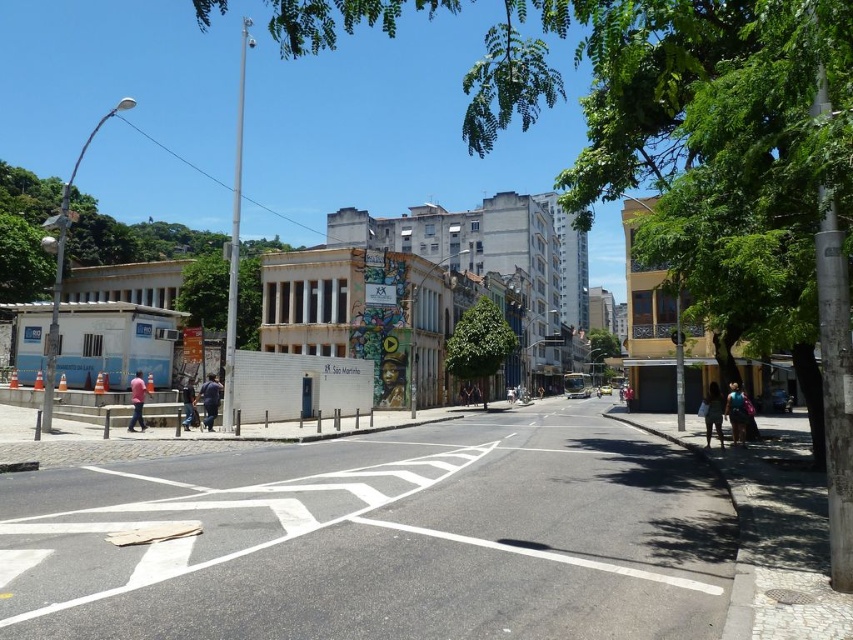
Question: Which of the following is the closest to the observer?

Choices:
 (A) (622, 392)
 (B) (183, 385)

Answer: (B)

Question: Does blue denim jeans at lower right have a larger size compared to dark blue jeans at lower center?

Choices:
 (A) yes
 (B) no

Answer: (A)

Question: Which point appears closest to the camera in this image?

Choices:
 (A) (624, 388)
 (B) (146, 388)
 (C) (711, 390)
 (D) (732, 435)

Answer: (C)

Question: In this image, where is blue denim jeans at lower right located relative to red leather jacket at center?

Choices:
 (A) right
 (B) left

Answer: (B)

Question: Based on their relative distances, which object is farther from the red leather jacket at center?

Choices:
 (A) dark blue jeans at lower right
 (B) blue denim jeans at lower right
 (C) dark blue jeans at lower center

Answer: (C)

Question: Can you confirm if dark blue fabric at center is positioned to the right of pink fabric shirt at lower left?

Choices:
 (A) yes
 (B) no

Answer: (A)